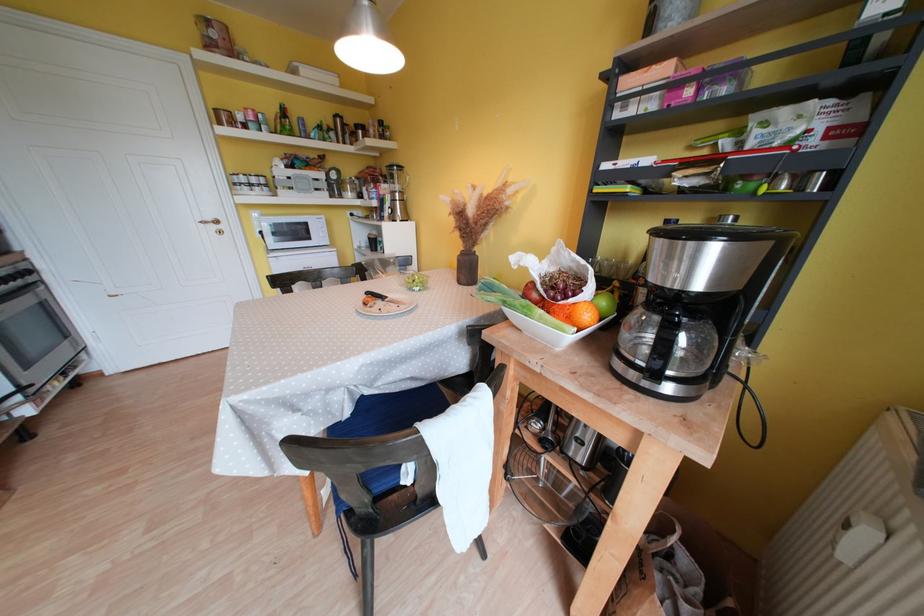
Which object does [532,294] point to?

This point indicates the red apple.